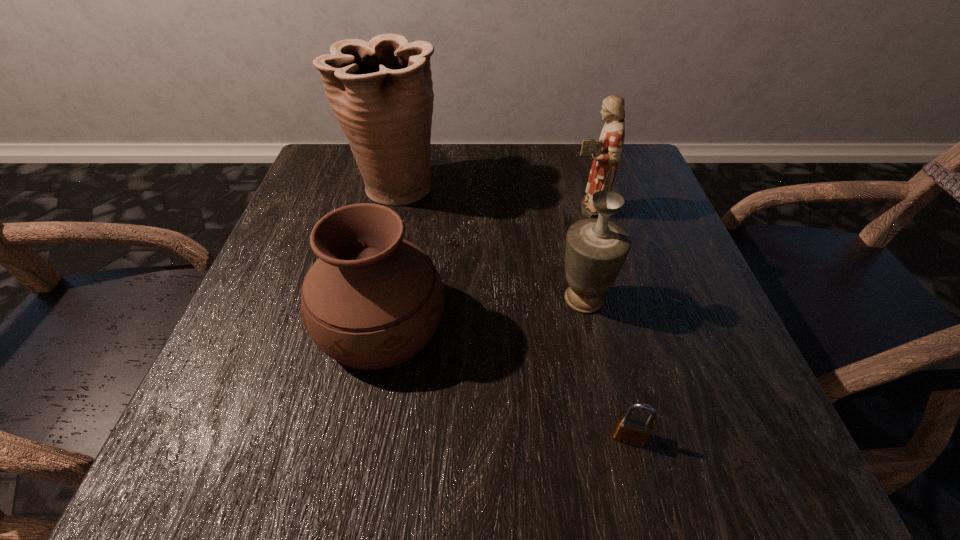
This screenshot has height=540, width=960. Find the location of `the closest object to the figurine`. the closest object to the figurine is located at coordinates (596, 248).

Identify which urn is located as the nearest to the figurine. Please provide its 2D coordinates. Your answer should be formatted as a tuple, i.e. [(x, y)], where the tuple contains the x and y coordinates of a point satisfying the conditions above.

[(596, 248)]

Locate an element on the screen. urn object that ranks as the second closest to the rightmost urn is located at coordinates (381, 92).

This screenshot has height=540, width=960. I want to click on free spot that satisfies the following two spatial constraints: 1. on the front side of the tallest object; 2. on the left side of the shortest object, so click(338, 436).